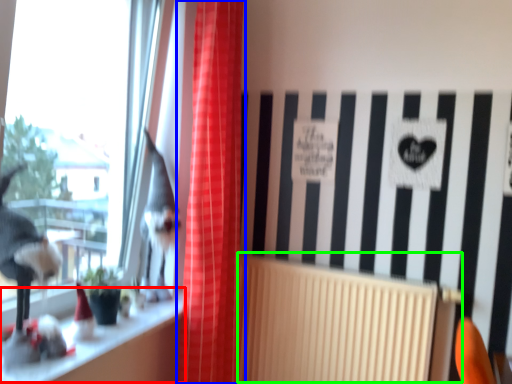
Question: Which object is the closest to the window sill (highlighted by a red box)? Choose among these: curtain (highlighted by a blue box) or radiator (highlighted by a green box).

Choices:
 (A) curtain
 (B) radiator

Answer: (A)